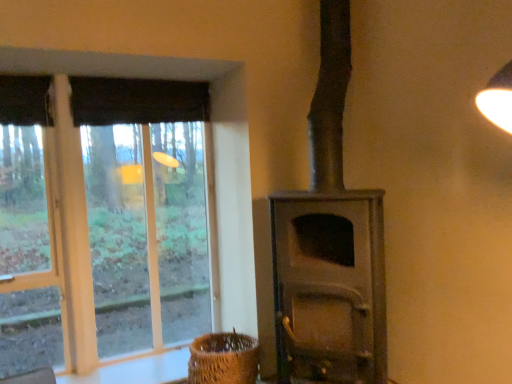
Question: From a real-world perspective, does brown woven basket at lower center sit lower than clear glass window at left?

Choices:
 (A) yes
 (B) no

Answer: (A)

Question: Is brown woven basket at lower center wider than clear glass window at left?

Choices:
 (A) yes
 (B) no

Answer: (A)

Question: Is brown woven basket at lower center looking in the opposite direction of clear glass window at left?

Choices:
 (A) no
 (B) yes

Answer: (B)

Question: Can you confirm if brown woven basket at lower center is positioned to the left of clear glass window at left?

Choices:
 (A) no
 (B) yes

Answer: (A)

Question: Are brown woven basket at lower center and clear glass window at left far apart?

Choices:
 (A) no
 (B) yes

Answer: (A)

Question: Considering the positions of brown woven basket at lower center and matte gray wood burning stove at center in the image, is brown woven basket at lower center bigger or smaller than matte gray wood burning stove at center?

Choices:
 (A) small
 (B) big

Answer: (A)

Question: Considering the positions of brown woven basket at lower center and matte gray wood burning stove at center in the image, is brown woven basket at lower center wider or thinner than matte gray wood burning stove at center?

Choices:
 (A) thin
 (B) wide

Answer: (A)

Question: Is point (237, 355) closer or farther from the camera than point (347, 34)?

Choices:
 (A) farther
 (B) closer

Answer: (B)

Question: From a real-world perspective, is brown woven basket at lower center above or below matte gray wood burning stove at center?

Choices:
 (A) above
 (B) below

Answer: (B)

Question: From the image's perspective, is clear glass window at left above or below brown woven basket at lower center?

Choices:
 (A) below
 (B) above

Answer: (B)

Question: Considering the positions of point (29, 51) and point (244, 374), is point (29, 51) closer or farther from the camera than point (244, 374)?

Choices:
 (A) closer
 (B) farther

Answer: (A)

Question: Looking at their shapes, would you say clear glass window at left is wider or thinner than brown woven basket at lower center?

Choices:
 (A) wide
 (B) thin

Answer: (B)

Question: Is clear glass window at left inside the boundaries of brown woven basket at lower center, or outside?

Choices:
 (A) inside
 (B) outside

Answer: (B)

Question: Would you say dark fabric curtain at upper left is inside or outside matte gray wood burning stove at center?

Choices:
 (A) inside
 (B) outside

Answer: (B)

Question: From a real-world perspective, is dark fabric curtain at upper left physically located above or below matte gray wood burning stove at center?

Choices:
 (A) above
 (B) below

Answer: (A)